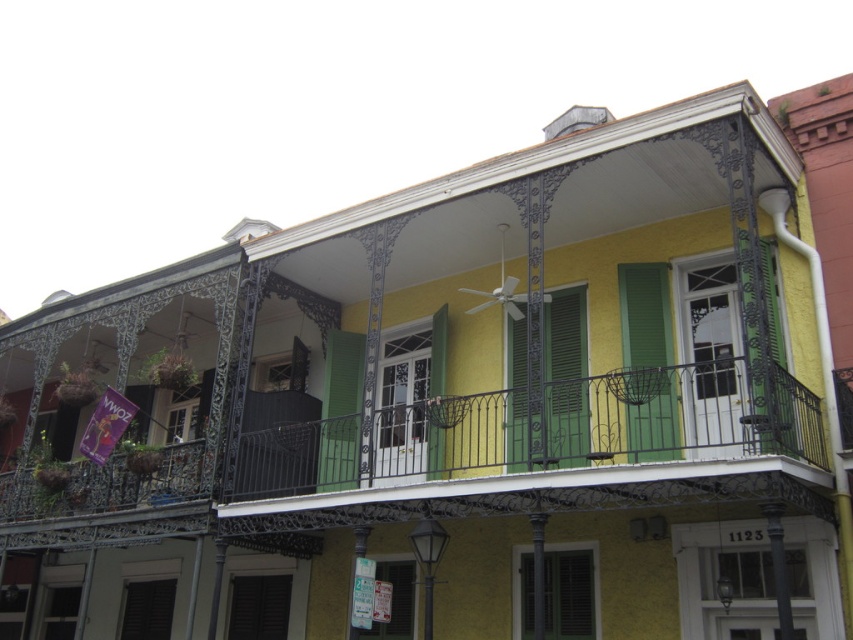
You are standing in front of the building and want to know if the green wrought iron balcony at center is positioned above or below the green matte shutter at center. Based on the scene description, can you determine their relative positions?

The green wrought iron balcony at center is below the green matte shutter at center.

You are standing in front of the building and want to take a photo. You notice two points marked on the facade. The first point is at coordinates point (701,390) and the second is at point (511,372). Which point will appear larger in your camera view?

Point (701,390) is closer to the camera than point (511,372), so it will appear larger in the camera view.